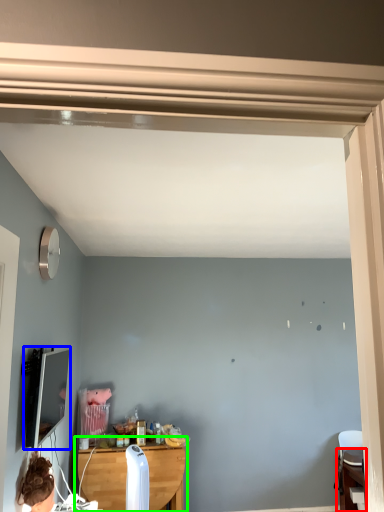
Question: Which object is the farthest from table (highlighted by a red box)? Choose among these: computer monitor (highlighted by a blue box) or table (highlighted by a green box).

Choices:
 (A) computer monitor
 (B) table

Answer: (A)